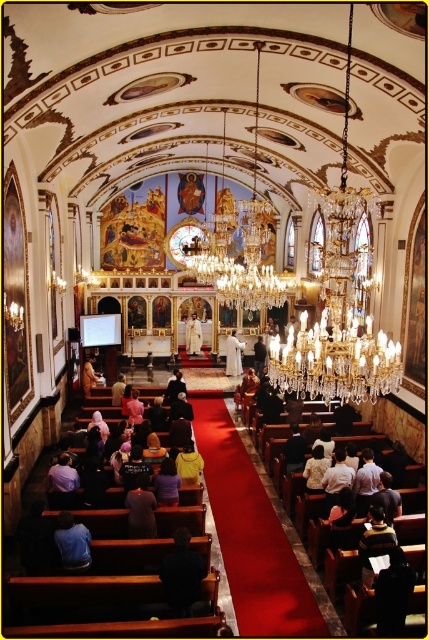
Question: Where is blue shirt at lower left located in relation to wooden chair at lower left in the image?

Choices:
 (A) below
 (B) above

Answer: (A)

Question: Does blue shirt at lower left have a smaller size compared to wooden chair at lower left?

Choices:
 (A) yes
 (B) no

Answer: (A)

Question: Which point is farther to the camera?

Choices:
 (A) (87, 371)
 (B) (238, 365)
 (C) (262, 356)

Answer: (C)

Question: Which object appears closest to the camera in this image?

Choices:
 (A) dark brown shirt at center
 (B) white clothed figure at center
 (C) white clothed person at center
 (D) wooden chair at lower left

Answer: (A)

Question: Which of these objects is positioned closest to the white clothed figure at center?

Choices:
 (A) dark brown shirt at center
 (B) wooden chair at lower left
 (C) white fabric robe at center
 (D) white clothed person at center

Answer: (D)

Question: Does blue shirt at lower left appear on the left side of wooden chair at lower left?

Choices:
 (A) yes
 (B) no

Answer: (B)